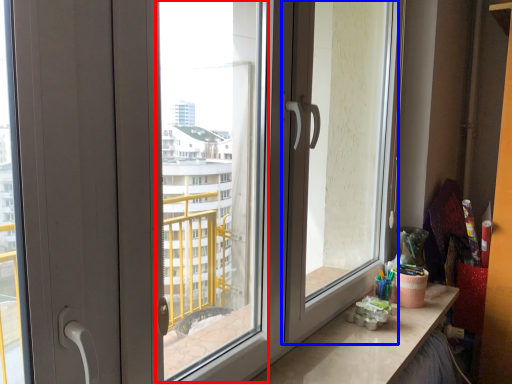
Question: Which point is closer to the camera, window screen (highlighted by a red box) or screen door (highlighted by a blue box)?

Choices:
 (A) window screen
 (B) screen door

Answer: (A)